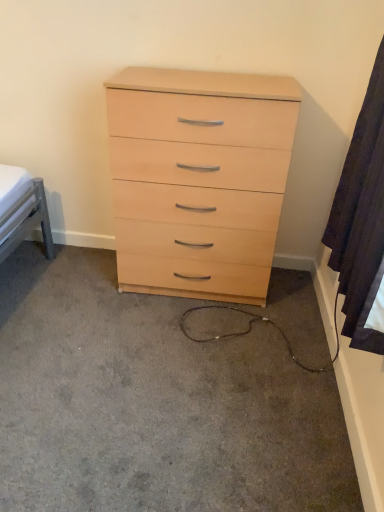
The height and width of the screenshot is (512, 384). Find the location of `free space in front of light wood/veneer chest of drawers at center`. free space in front of light wood/veneer chest of drawers at center is located at coordinates (187, 347).